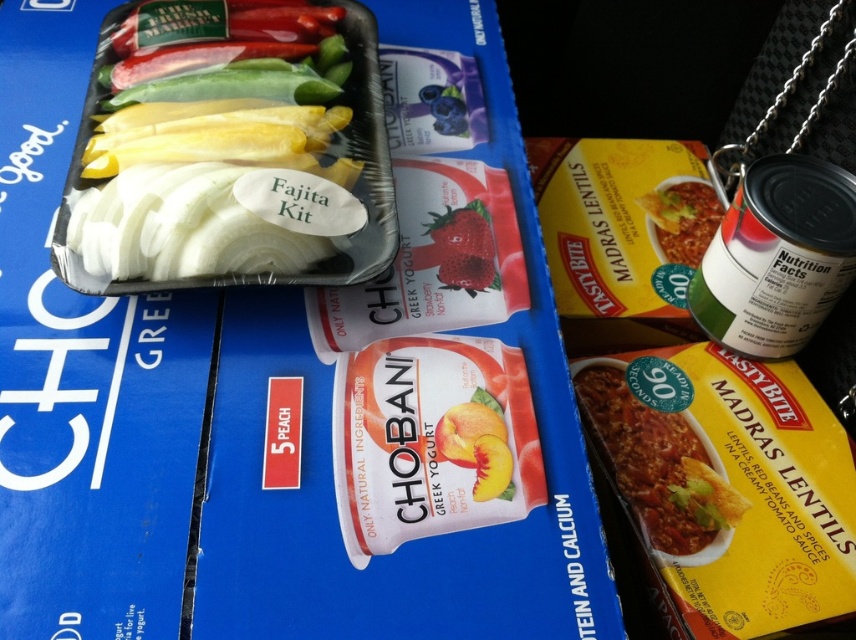
Which is behind, point (632, 481) or point (477, 280)?

The point (632, 481) is more distant.

Is yellow matte lentils at lower right further to camera compared to strawberry matte at center?

No.

What do you see at coordinates (655, 465) in the screenshot? I see `yellow matte lentils at lower right` at bounding box center [655, 465].

Locate an element on the screen. This screenshot has width=856, height=640. yellow matte lentils at lower right is located at coordinates (655, 465).

Which of these two, clear plastic fajita kit at upper left or green matte can at upper right, stands taller?

With more height is clear plastic fajita kit at upper left.

Who is more forward, (108, 262) or (785, 262)?

Point (108, 262) is in front.

Who is more forward, (122, 236) or (831, 204)?

Point (122, 236) is more forward.

In order to click on clear plastic fajita kit at upper left in this screenshot , I will do `click(229, 148)`.

Can you confirm if clear plastic fajita kit at upper left is bigger than yellow matte lentils at lower right?

Correct, clear plastic fajita kit at upper left is larger in size than yellow matte lentils at lower right.

Between clear plastic fajita kit at upper left and yellow matte lentils at lower right, which one is positioned lower?

yellow matte lentils at lower right is below.

Where is `clear plastic fajita kit at upper left`? This screenshot has height=640, width=856. clear plastic fajita kit at upper left is located at coordinates (x=229, y=148).

Locate an element on the screen. This screenshot has width=856, height=640. clear plastic fajita kit at upper left is located at coordinates (229, 148).